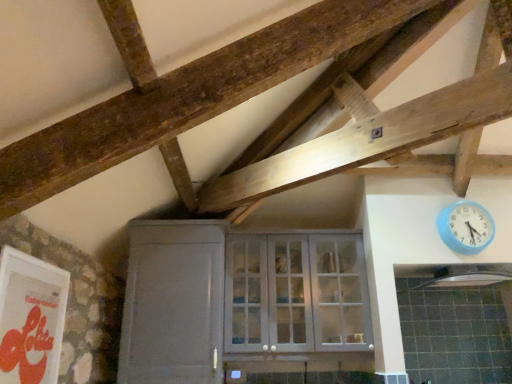
Question: Does blue plastic wall clock at upper right turn towards white glass cabinet at center?

Choices:
 (A) yes
 (B) no

Answer: (B)

Question: Does blue plastic wall clock at upper right have a lesser width compared to white glass cabinet at center?

Choices:
 (A) yes
 (B) no

Answer: (A)

Question: Considering the relative sizes of blue plastic wall clock at upper right and white glass cabinet at center in the image provided, is blue plastic wall clock at upper right shorter than white glass cabinet at center?

Choices:
 (A) no
 (B) yes

Answer: (B)

Question: Is white glass cabinet at center located within blue plastic wall clock at upper right?

Choices:
 (A) yes
 (B) no

Answer: (B)

Question: Can you confirm if blue plastic wall clock at upper right is positioned to the left of white glass cabinet at center?

Choices:
 (A) no
 (B) yes

Answer: (A)

Question: Considering the positions of white glass cabinet at center and black matte exhaust hood at upper right in the image, is white glass cabinet at center wider or thinner than black matte exhaust hood at upper right?

Choices:
 (A) wide
 (B) thin

Answer: (B)

Question: Looking at the image, does white glass cabinet at center seem bigger or smaller compared to black matte exhaust hood at upper right?

Choices:
 (A) big
 (B) small

Answer: (A)

Question: From a real-world perspective, is white glass cabinet at center above or below black matte exhaust hood at upper right?

Choices:
 (A) above
 (B) below

Answer: (B)

Question: Is white glass cabinet at center taller or shorter than black matte exhaust hood at upper right?

Choices:
 (A) tall
 (B) short

Answer: (A)

Question: Is blue plastic wall clock at upper right in front of or behind black matte exhaust hood at upper right in the image?

Choices:
 (A) behind
 (B) front

Answer: (A)

Question: Looking at the image, does blue plastic wall clock at upper right seem bigger or smaller compared to black matte exhaust hood at upper right?

Choices:
 (A) small
 (B) big

Answer: (A)

Question: Which is correct: blue plastic wall clock at upper right is inside black matte exhaust hood at upper right, or outside of it?

Choices:
 (A) inside
 (B) outside

Answer: (B)

Question: From a real-world perspective, is blue plastic wall clock at upper right above or below black matte exhaust hood at upper right?

Choices:
 (A) above
 (B) below

Answer: (A)

Question: In terms of width, does white matte door at lower left look wider or thinner when compared to white glass cabinet at center?

Choices:
 (A) wide
 (B) thin

Answer: (A)

Question: Is white matte door at lower left bigger or smaller than white glass cabinet at center?

Choices:
 (A) big
 (B) small

Answer: (A)